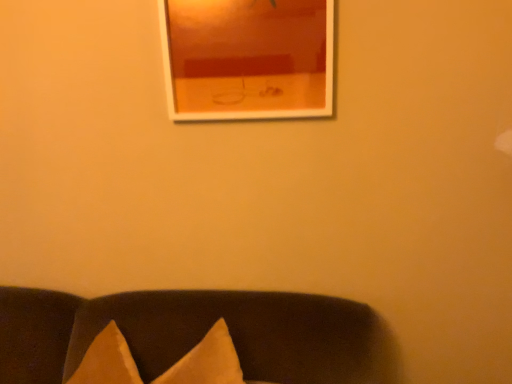
Question: Is there a large distance between white glossy picture frame at upper center and matte fabric cushions at lower center?

Choices:
 (A) yes
 (B) no

Answer: (B)

Question: Is white glossy picture frame at upper center shorter than matte fabric cushions at lower center?

Choices:
 (A) yes
 (B) no

Answer: (A)

Question: From the image's perspective, is white glossy picture frame at upper center on matte fabric cushions at lower center?

Choices:
 (A) yes
 (B) no

Answer: (A)

Question: Can you confirm if white glossy picture frame at upper center is wider than matte fabric cushions at lower center?

Choices:
 (A) no
 (B) yes

Answer: (A)

Question: From a real-world perspective, is white glossy picture frame at upper center physically below matte fabric cushions at lower center?

Choices:
 (A) no
 (B) yes

Answer: (A)

Question: Does white glossy picture frame at upper center contain matte fabric cushions at lower center?

Choices:
 (A) no
 (B) yes

Answer: (A)

Question: Considering the relative positions of matte fabric cushions at lower center and white glossy picture frame at upper center in the image provided, is matte fabric cushions at lower center to the right of white glossy picture frame at upper center from the viewer's perspective?

Choices:
 (A) yes
 (B) no

Answer: (B)

Question: From a real-world perspective, is matte fabric cushions at lower center positioned over white glossy picture frame at upper center based on gravity?

Choices:
 (A) no
 (B) yes

Answer: (A)

Question: Does matte fabric cushions at lower center come behind white glossy picture frame at upper center?

Choices:
 (A) no
 (B) yes

Answer: (A)

Question: From the image's perspective, does matte fabric cushions at lower center appear lower than white glossy picture frame at upper center?

Choices:
 (A) yes
 (B) no

Answer: (A)

Question: Does matte fabric cushions at lower center have a lesser height compared to white glossy picture frame at upper center?

Choices:
 (A) yes
 (B) no

Answer: (B)

Question: Is matte fabric cushions at lower center thinner than white glossy picture frame at upper center?

Choices:
 (A) yes
 (B) no

Answer: (B)

Question: From a real-world perspective, is matte fabric cushions at lower center above or below white glossy picture frame at upper center?

Choices:
 (A) below
 (B) above

Answer: (A)